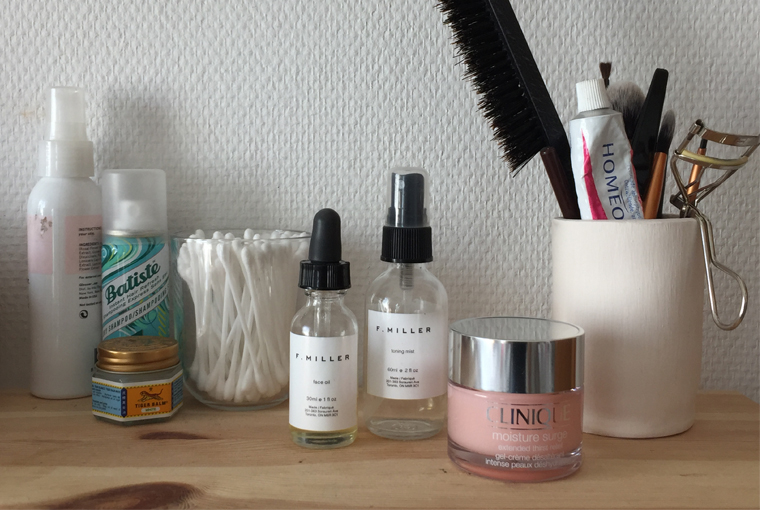
You are a GUI agent. You are given a task and a screenshot of the screen. Output one action in this format:
    pyautogui.click(x=<x>, y=<y>)
    Task: Click on the white textured wallpaper
    
    Given the screenshot: What is the action you would take?
    pyautogui.click(x=255, y=94)